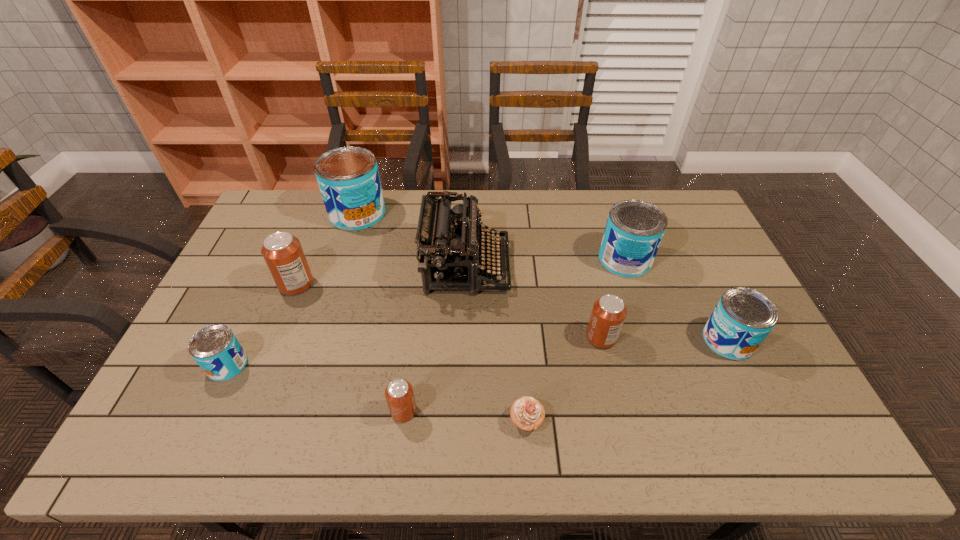
Where is `vacant space located 0.310m on the left of the rightmost blue can`? vacant space located 0.310m on the left of the rightmost blue can is located at coordinates (592, 340).

This screenshot has height=540, width=960. In order to click on vacant space located 0.140m on the back of the smallest blue can in this screenshot , I will do `click(253, 309)`.

Identify the location of vacant space located on the left of the smallest orange can. (259, 411).

Image resolution: width=960 pixels, height=540 pixels. Find the location of `free region located 0.380m on the right of the cupcake`. free region located 0.380m on the right of the cupcake is located at coordinates (702, 420).

Image resolution: width=960 pixels, height=540 pixels. I want to click on object that is positioned at the far edge, so click(x=348, y=178).

Where is `can that is positioned at the near edge`? The width and height of the screenshot is (960, 540). can that is positioned at the near edge is located at coordinates (399, 394).

Identify the location of cupcake that is at the near edge. Image resolution: width=960 pixels, height=540 pixels. (527, 413).

Locate an element on the screen. This screenshot has width=960, height=540. object at the left edge is located at coordinates click(x=215, y=348).

Identify the location of object present at the right edge. (743, 318).

In the image, there is a desktop. Where is `vacant space at the far edge`? The width and height of the screenshot is (960, 540). vacant space at the far edge is located at coordinates (617, 200).